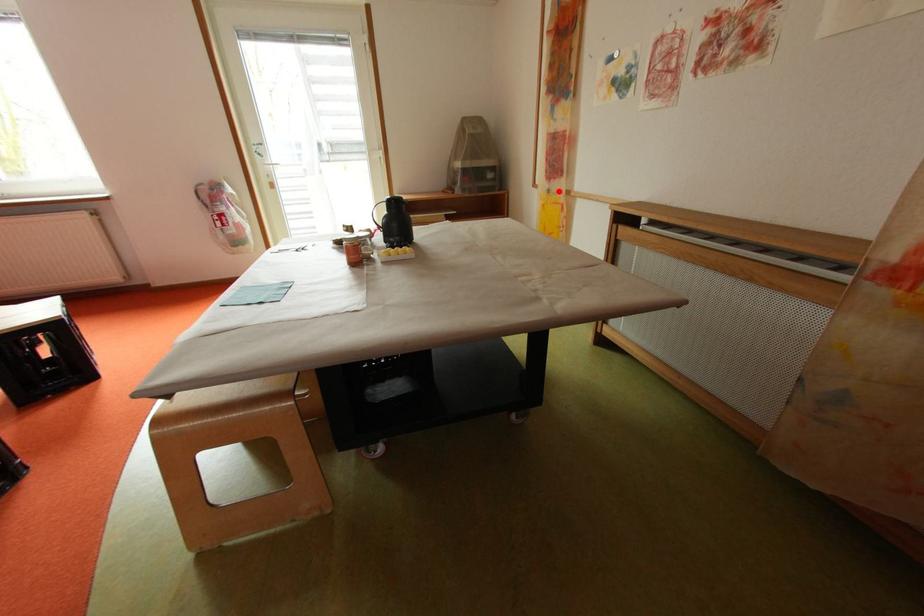
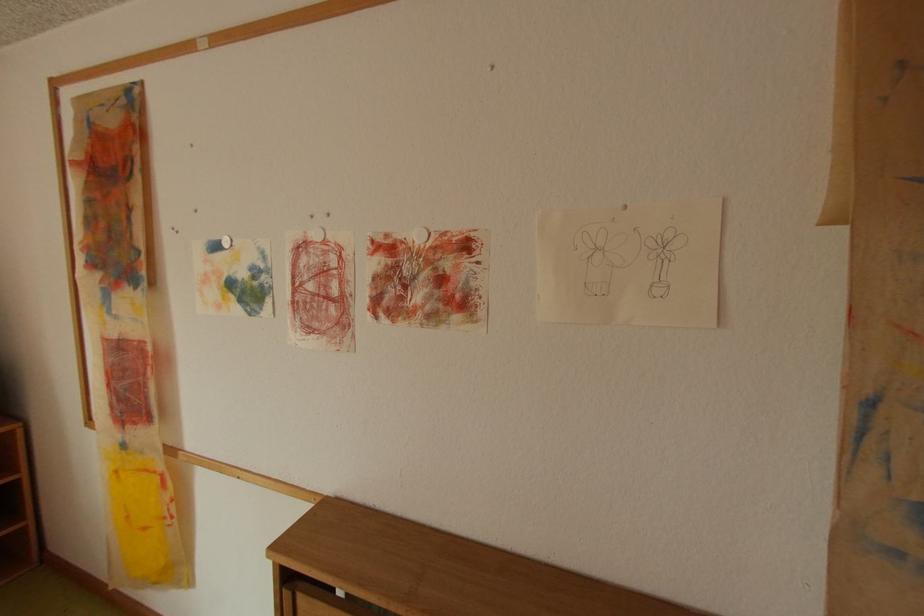
Question: I am providing you with two images of the same scene from different viewpoints. A red point is marked on the first image. Can you still see the location of the red point in image 2?

Choices:
 (A) Yes
 (B) No

Answer: (A)